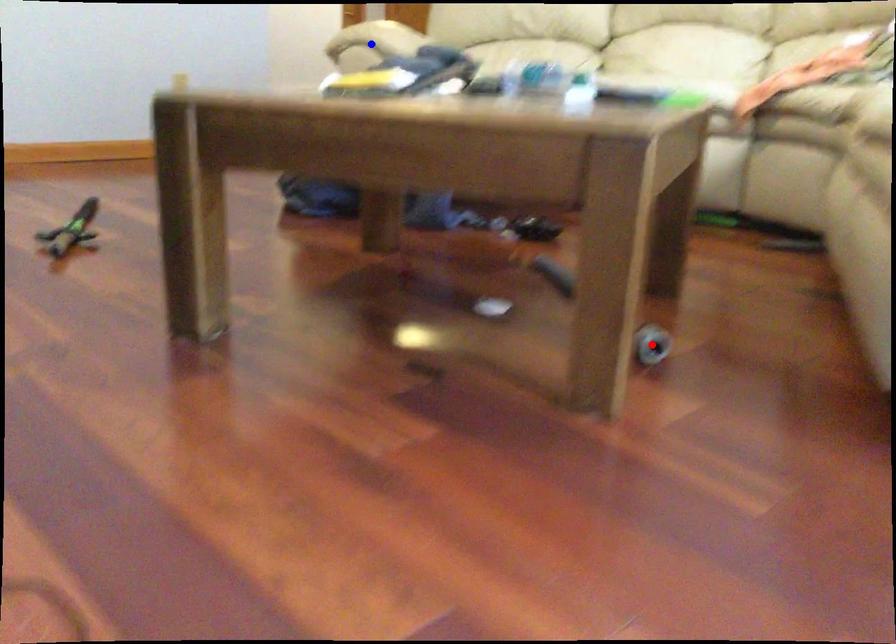
Question: In the image, two points are highlighted. Which point is nearer to the camera? Reply with the corresponding letter.

Choices:
 (A) blue point
 (B) red point

Answer: (B)